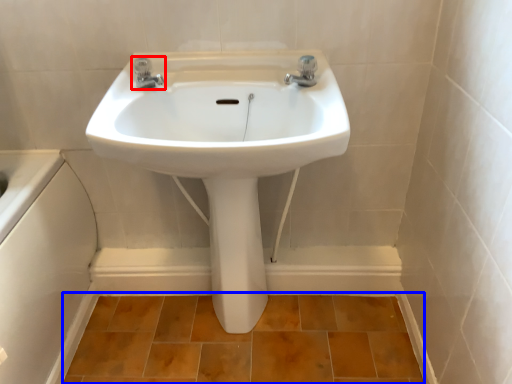
Question: Among these objects, which one is farthest to the camera, tap (highlighted by a red box) or ceramic tile (highlighted by a blue box)?

Choices:
 (A) tap
 (B) ceramic tile

Answer: (B)